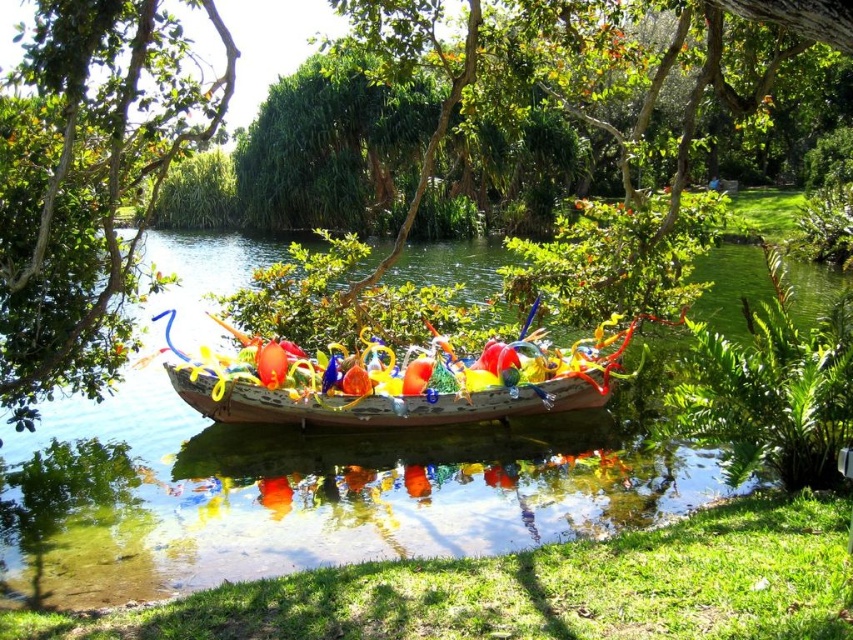
You are a bird flying over the serene outdoor scene. You want to land on the tallest object between the green leafy tree at left and the translucent glass boat at center. Which object should you choose?

The green leafy tree at left is taller than the translucent glass boat at center, so you should land on the green leafy tree at left.

You are standing at the point marked by coordinates point (90, 186) in the image. What object is located exactly at that point?

The point (90, 186) is occupied by the green leafy tree at center.